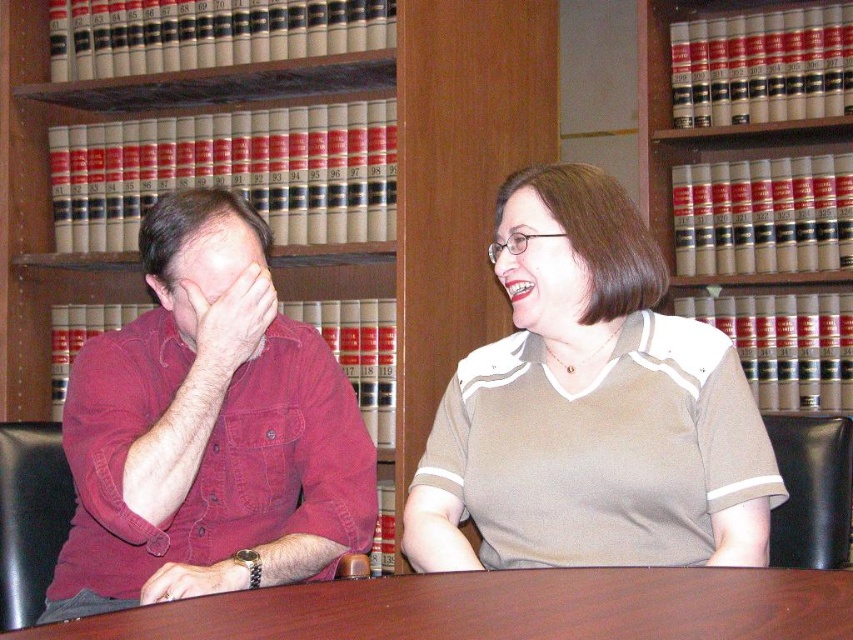
Question: Which point is farther from the camera taking this photo?

Choices:
 (A) (824, 579)
 (B) (308, 406)
 (C) (534, 451)
 (D) (607, 550)

Answer: (B)

Question: Can you confirm if wooden bookshelf at center is wider than beige paperbacks at upper right?

Choices:
 (A) yes
 (B) no

Answer: (A)

Question: Can you confirm if red shirt at left is bigger than brown wood table at center?

Choices:
 (A) no
 (B) yes

Answer: (B)

Question: Which point is closer to the camera?

Choices:
 (A) red shirt at left
 (B) matte red shirt at left
 (C) brown wood table at center

Answer: (C)

Question: Which object is positioned closest to the matte red shirt at left?

Choices:
 (A) beige paperbacks at upper right
 (B) wooden bookshelf at center
 (C) brown wood table at center

Answer: (C)

Question: Considering the relative positions of matte red shirt at left and brown wood table at center in the image provided, where is matte red shirt at left located with respect to brown wood table at center?

Choices:
 (A) above
 (B) below

Answer: (A)